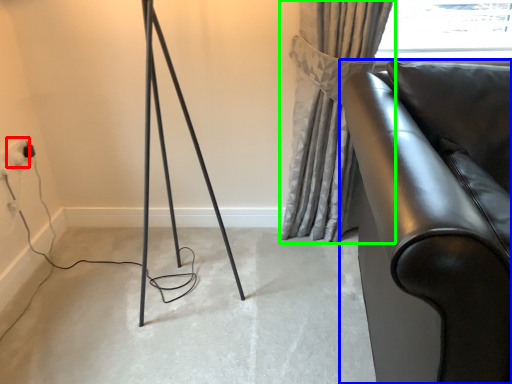
Question: Which object is positioned closest to electric outlet (highlighted by a red box)? Select from furniture (highlighted by a blue box) and curtain (highlighted by a green box).

Choices:
 (A) furniture
 (B) curtain

Answer: (B)